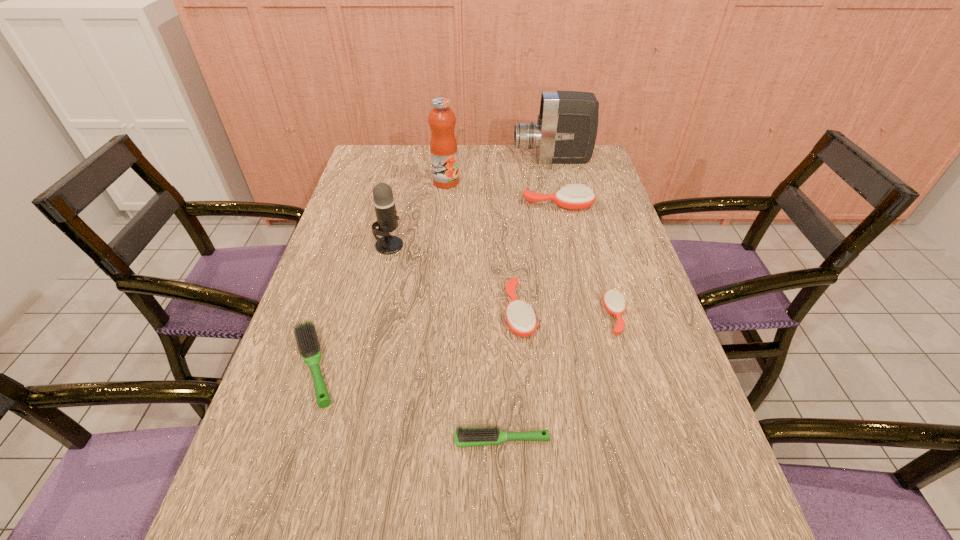
Identify the location of blank space located 0.160m on the left of the fourth shortest hairbrush. (439, 313).

Image resolution: width=960 pixels, height=540 pixels. Find the location of `blank space located 0.290m on the right of the left light hairbrush`. blank space located 0.290m on the right of the left light hairbrush is located at coordinates (475, 366).

Find the location of `free space located 0.200m on the left of the smallest orange hairbrush`. free space located 0.200m on the left of the smallest orange hairbrush is located at coordinates (522, 316).

You are a GUI agent. You are given a task and a screenshot of the screen. Output one action in this format:
    pyautogui.click(x=<x>, y=<y>)
    Task: Click on the blank space located on the right of the smaller light hairbrush
    The height and width of the screenshot is (540, 960).
    Given the screenshot: What is the action you would take?
    [x=595, y=440]

Image resolution: width=960 pixels, height=540 pixels. What are the coordinates of `fruit juice that is at the far edge` in the screenshot? It's located at (443, 145).

This screenshot has width=960, height=540. What are the coordinates of `camcorder located at the far edge` in the screenshot? It's located at (565, 133).

I want to click on microphone located in the left edge section of the desktop, so [384, 203].

The height and width of the screenshot is (540, 960). I want to click on hairbrush located in the left edge section of the desktop, so click(x=307, y=339).

Identify the location of camcorder that is at the right edge. This screenshot has width=960, height=540. (565, 133).

Identify the location of object at the far right corner. Image resolution: width=960 pixels, height=540 pixels. (565, 133).